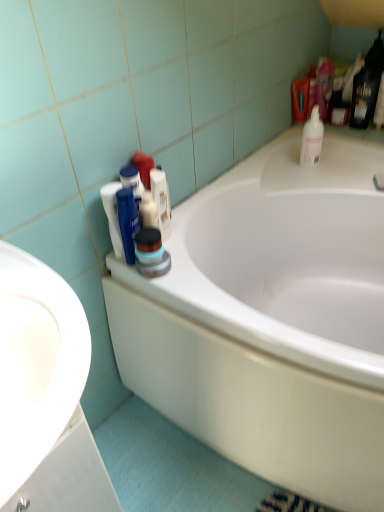
Question: Is white glossy bathtub at center smaller than white plastic bottle at upper right, which is the first cleaning product from top to bottom?

Choices:
 (A) no
 (B) yes

Answer: (A)

Question: Considering the relative sizes of white glossy bathtub at center and white plastic bottle at upper right, which is the first cleaning product from top to bottom, in the image provided, is white glossy bathtub at center shorter than white plastic bottle at upper right, which is the first cleaning product from top to bottom,?

Choices:
 (A) no
 (B) yes

Answer: (A)

Question: From the image's perspective, is white glossy bathtub at center located above white plastic bottle at upper right, acting as the 1th cleaning product starting from the right?

Choices:
 (A) yes
 (B) no

Answer: (B)

Question: Does white glossy bathtub at center come in front of white plastic bottle at upper right, arranged as the first cleaning product when viewed from the back?

Choices:
 (A) no
 (B) yes

Answer: (B)

Question: Considering the relative sizes of white glossy bathtub at center and white plastic bottle at upper right, the 2th cleaning product viewed from the left, in the image provided, is white glossy bathtub at center bigger than white plastic bottle at upper right, the 2th cleaning product viewed from the left,?

Choices:
 (A) yes
 (B) no

Answer: (A)

Question: Do you think white plastic bottle at upper right, arranged as the first cleaning product when viewed from the back, is within white matte shaving cream at upper center, or outside of it?

Choices:
 (A) inside
 (B) outside

Answer: (B)

Question: Based on their positions, is white plastic bottle at upper right, which is counted as the second cleaning product, starting from the front, located to the left or right of white matte shaving cream at upper center?

Choices:
 (A) left
 (B) right

Answer: (B)

Question: Considering the positions of white plastic bottle at upper right, acting as the 1th cleaning product starting from the right, and white matte shaving cream at upper center in the image, is white plastic bottle at upper right, acting as the 1th cleaning product starting from the right, wider or thinner than white matte shaving cream at upper center?

Choices:
 (A) thin
 (B) wide

Answer: (B)

Question: Is point (311, 150) closer or farther from the camera than point (167, 203)?

Choices:
 (A) closer
 (B) farther

Answer: (B)

Question: In the image, is white glossy bathtub at center positioned in front of or behind white glossy sink at left?

Choices:
 (A) front
 (B) behind

Answer: (B)

Question: Based on their positions, is white glossy bathtub at center located to the left or right of white glossy sink at left?

Choices:
 (A) left
 (B) right

Answer: (B)

Question: Is white glossy bathtub at center inside the boundaries of white glossy sink at left, or outside?

Choices:
 (A) outside
 (B) inside

Answer: (A)

Question: From the image's perspective, relative to white glossy sink at left, is white glossy bathtub at center above or below?

Choices:
 (A) above
 (B) below

Answer: (A)

Question: Considering the positions of point (162, 185) and point (9, 473), is point (162, 185) closer or farther from the camera than point (9, 473)?

Choices:
 (A) farther
 (B) closer

Answer: (A)

Question: Considering the positions of white matte shaving cream at upper center and white glossy sink at left in the image, is white matte shaving cream at upper center bigger or smaller than white glossy sink at left?

Choices:
 (A) small
 (B) big

Answer: (A)